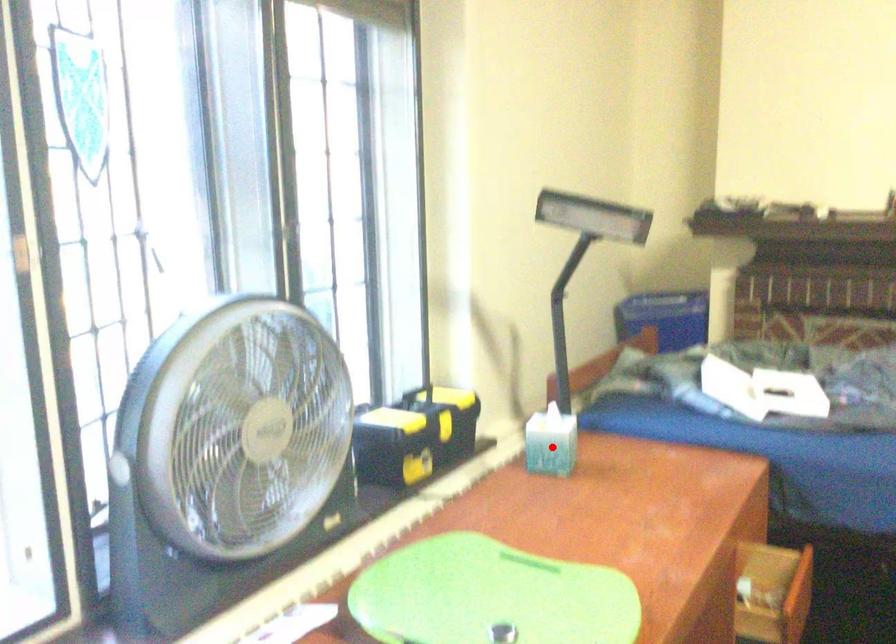
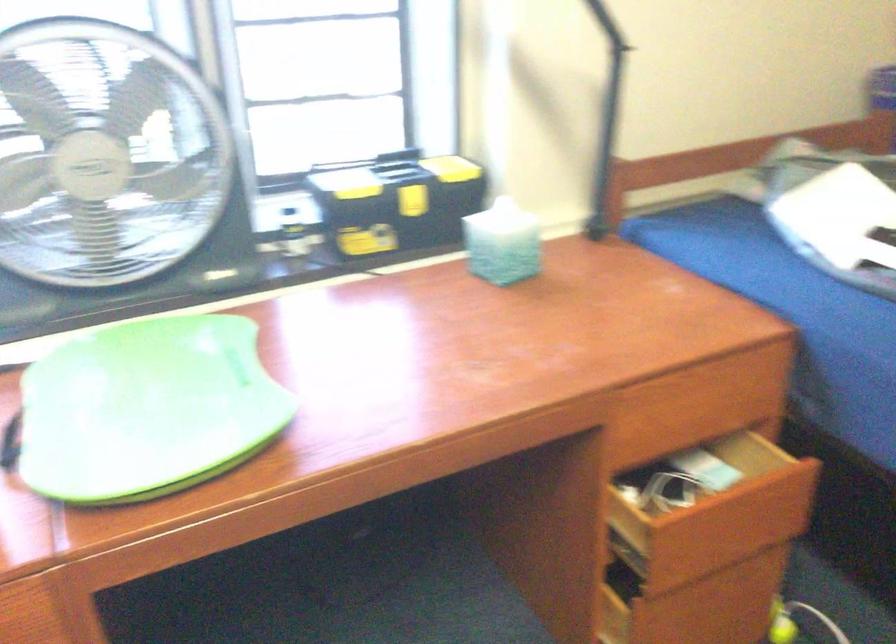
Question: I am providing you with two images of the same scene from different viewpoints. A red point is shown in image1. For the corresponding object point in image2, is it positioned nearer or farther from the camera?

Choices:
 (A) Nearer
 (B) Farther

Answer: (A)